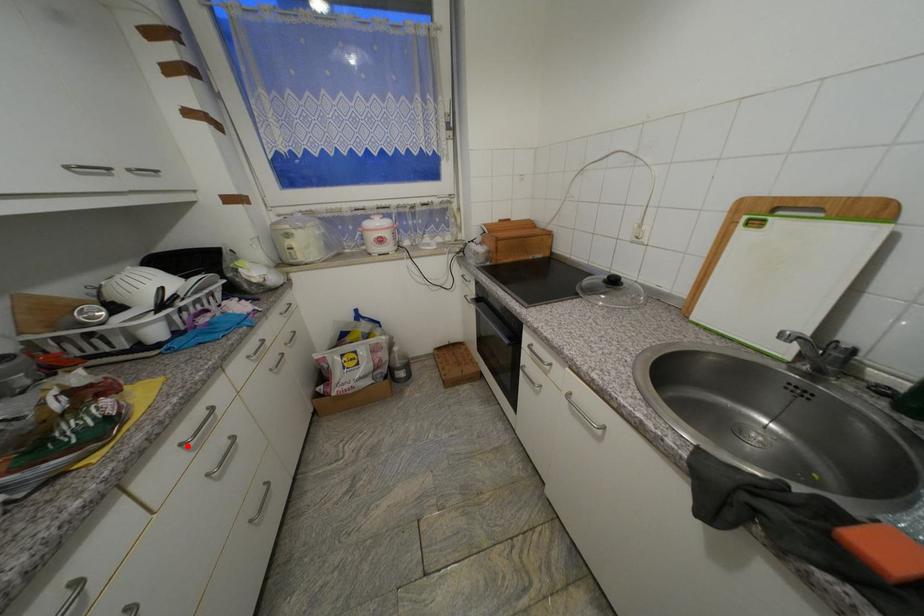
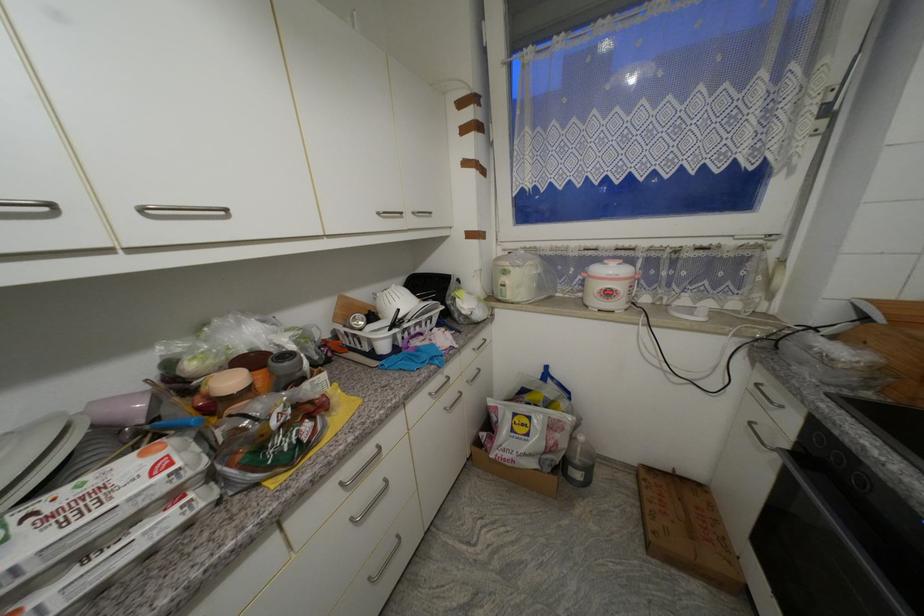
Locate, in the second image, the point that corresponds to the highlighted location in the first image.

(347, 485)